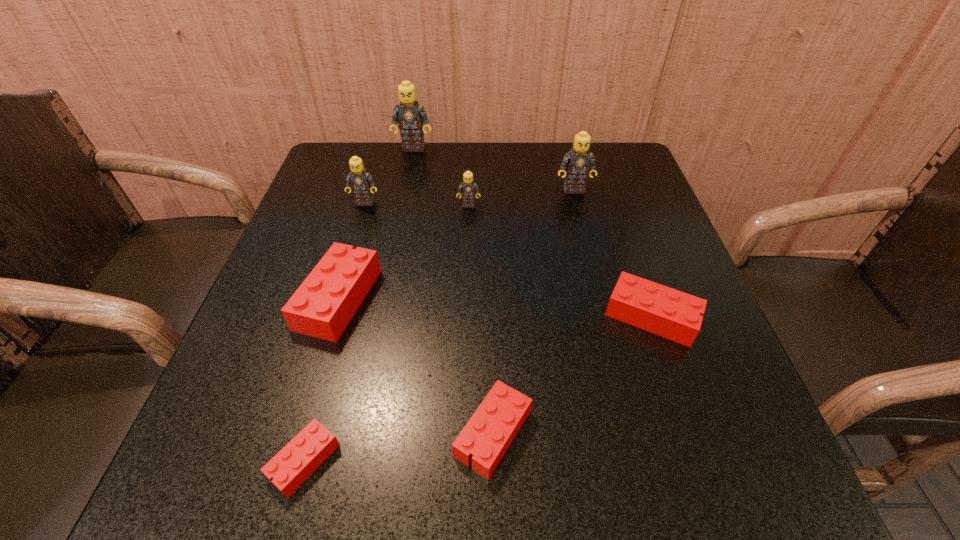
Where is `vacant region that satisfies the following two spatial constraints: 1. in front of the second smallest tan Lego; 2. on the right side of the rightmost red Lego`? The height and width of the screenshot is (540, 960). vacant region that satisfies the following two spatial constraints: 1. in front of the second smallest tan Lego; 2. on the right side of the rightmost red Lego is located at coordinates (330, 316).

Where is `blank area in the image that satisfies the following two spatial constraints: 1. in front of the smallest tan Lego; 2. on the left side of the sixth tallest Lego`? The height and width of the screenshot is (540, 960). blank area in the image that satisfies the following two spatial constraints: 1. in front of the smallest tan Lego; 2. on the left side of the sixth tallest Lego is located at coordinates coord(466,316).

Where is `vacant point that satisfies the following two spatial constraints: 1. in front of the fourth shortest Lego; 2. on the left side of the second smallest tan Lego`? vacant point that satisfies the following two spatial constraints: 1. in front of the fourth shortest Lego; 2. on the left side of the second smallest tan Lego is located at coordinates (336, 300).

I want to click on free space that satisfies the following two spatial constraints: 1. in front of the rightmost red Lego; 2. on the left side of the fifth shortest object, so click(x=466, y=316).

Locate an element on the screen. This screenshot has height=540, width=960. vacant space that satisfies the following two spatial constraints: 1. in front of the third biggest red Lego; 2. on the right side of the second smallest tan Lego is located at coordinates (296, 433).

The width and height of the screenshot is (960, 540). In order to click on free space that satisfies the following two spatial constraints: 1. in front of the sixth shortest object; 2. on the right side of the biggest red Lego in this screenshot , I will do `click(336, 300)`.

Identify the location of free spot that satisfies the following two spatial constraints: 1. in front of the third shortest object; 2. on the left side of the second farthest Lego. Image resolution: width=960 pixels, height=540 pixels. 606,316.